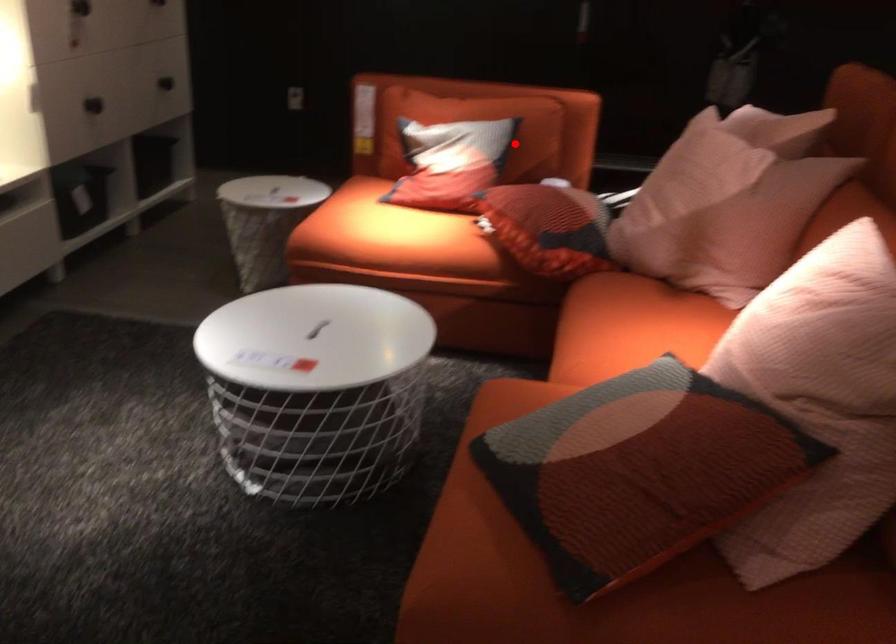
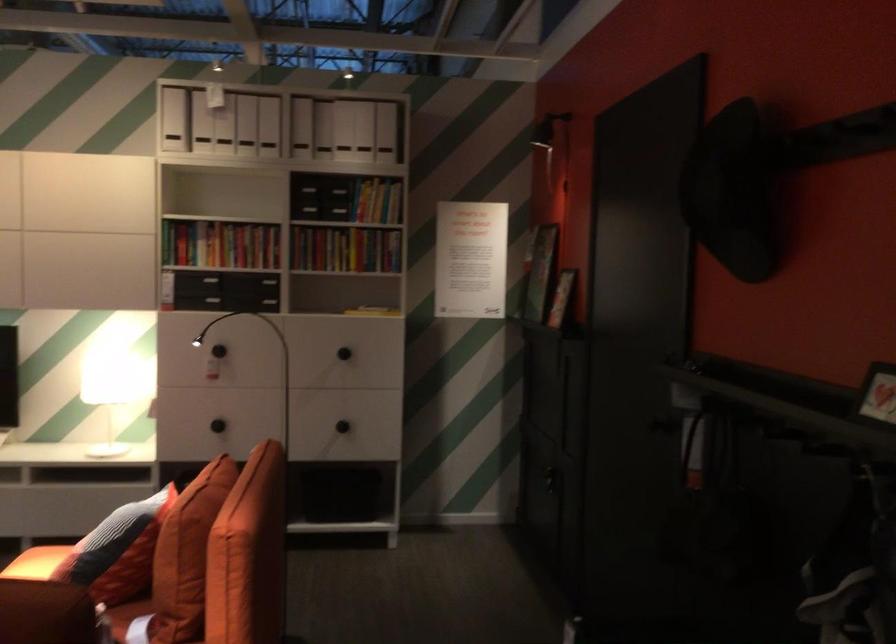
Find the pixel in the second image that matches the highlighted location in the first image.

(117, 551)